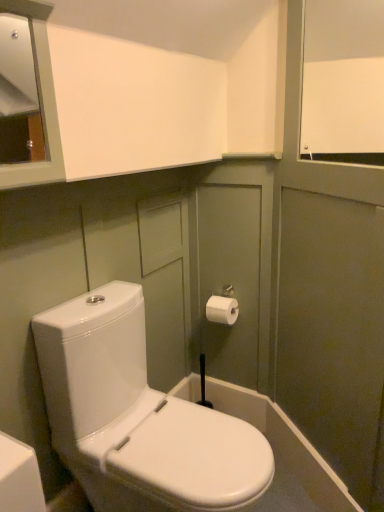
Question: Does point (49, 310) appear closer or farther from the camera than point (221, 302)?

Choices:
 (A) closer
 (B) farther

Answer: (A)

Question: Is white glossy toilet at center spatially inside white paper toilet paper at upper right, or outside of it?

Choices:
 (A) outside
 (B) inside

Answer: (A)

Question: Considering the real-world distances, which object is farthest from the white matte window screen at upper right?

Choices:
 (A) white paper toilet paper at upper right
 (B) white glossy toilet at center

Answer: (B)

Question: Which object is positioned farthest from the white glossy toilet at center?

Choices:
 (A) white matte window screen at upper right
 (B) white paper toilet paper at upper right

Answer: (A)